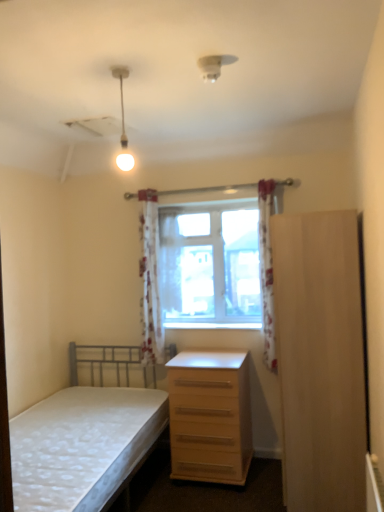
The height and width of the screenshot is (512, 384). Describe the element at coordinates (267, 272) in the screenshot. I see `white floral fabric curtain at right, the 3th curtain from the left` at that location.

Where is `matte white bulb at upper center`? The image size is (384, 512). matte white bulb at upper center is located at coordinates (123, 122).

Locate an element on the screen. The height and width of the screenshot is (512, 384). light wood/file cabinet at right is located at coordinates (320, 360).

From a real-world perspective, is white floral fabric curtain at center, acting as the 3th curtain starting from the right, physically below light wood/file cabinet at right?

No, from a real-world perspective, white floral fabric curtain at center, acting as the 3th curtain starting from the right, is not below light wood/file cabinet at right.

Which object is closer to the camera, white floral fabric curtain at center, which is the first curtain from left to right, or light wood/file cabinet at right?

light wood/file cabinet at right is closer to the camera.

Is white floral fabric curtain at center, which is the first curtain from left to right, taller or shorter than light wood/file cabinet at right?

white floral fabric curtain at center, which is the first curtain from left to right, is shorter than light wood/file cabinet at right.

Can you see white floral fabric curtain at center, which is the first curtain from left to right, touching light wood/file cabinet at right?

There is a gap between white floral fabric curtain at center, which is the first curtain from left to right, and light wood/file cabinet at right.

The image size is (384, 512). I want to click on light fixture located on the left of white floral fabric curtain at right, the first curtain when ordered from right to left, so tap(123, 122).

From a real-world perspective, is white floral fabric curtain at right, the first curtain when ordered from right to left, on top of matte white bulb at upper center?

No, from a real-world perspective, white floral fabric curtain at right, the first curtain when ordered from right to left, is not above matte white bulb at upper center.

In the scene shown: Is white floral fabric curtain at right, which ranks as the 3th curtain in back-to-front order, positioned far away from matte white bulb at upper center?

Yes, white floral fabric curtain at right, which ranks as the 3th curtain in back-to-front order, and matte white bulb at upper center are located far from each other.

Who is smaller, white floral fabric curtain at right, the first curtain when ordered from right to left, or matte white bulb at upper center?

matte white bulb at upper center is smaller.

Which of these two, white floral fabric curtain at right, the first curtain when ordered from right to left, or light wood/wooden chest of drawers at lower right, is thinner?

→ With smaller width is white floral fabric curtain at right, the first curtain when ordered from right to left.

Is white floral fabric curtain at right, the 3th curtain from the left, shorter than light wood/wooden chest of drawers at lower right?

No.

Is white floral fabric curtain at right, the 3th curtain from the left, oriented towards light wood/wooden chest of drawers at lower right?

No, white floral fabric curtain at right, the 3th curtain from the left, is not facing towards light wood/wooden chest of drawers at lower right.

Find the location of a particular element. Image resolution: width=384 pixels, height=512 pixels. curtain that is the 1st one above the light wood/wooden chest of drawers at lower right (from a real-world perspective) is located at coordinates (267, 272).

Is matte white bulb at upper center not close to white floral fabric curtain at center, which is the first curtain from left to right?

matte white bulb at upper center is near white floral fabric curtain at center, which is the first curtain from left to right, not far away.

The height and width of the screenshot is (512, 384). There is a matte white bulb at upper center. Find the location of `the 3rd curtain below it (from the image's perspective)`. the 3rd curtain below it (from the image's perspective) is located at coordinates (150, 281).

Considering the relative sizes of matte white bulb at upper center and white floral fabric curtain at center, acting as the 3th curtain starting from the right, in the image provided, is matte white bulb at upper center thinner than white floral fabric curtain at center, acting as the 3th curtain starting from the right,?

Correct, the width of matte white bulb at upper center is less than that of white floral fabric curtain at center, acting as the 3th curtain starting from the right.

Which is in front, matte white bulb at upper center or white floral fabric curtain at center, which is counted as the second curtain, starting from the front?

matte white bulb at upper center is closer to the camera.

Visually, is light wood/file cabinet at right positioned to the left or to the right of white floral fabric curtain at right, the 3th curtain from the left?

From the image, it's evident that light wood/file cabinet at right is to the right of white floral fabric curtain at right, the 3th curtain from the left.

Is the surface of light wood/file cabinet at right in direct contact with white floral fabric curtain at right, which ranks as the 1th curtain in front-to-back order?

No.

Based on their sizes in the image, would you say light wood/file cabinet at right is bigger or smaller than white floral fabric curtain at right, which ranks as the 1th curtain in front-to-back order?

In the image, light wood/file cabinet at right appears to be larger than white floral fabric curtain at right, which ranks as the 1th curtain in front-to-back order.

Between point (308, 426) and point (265, 218), which one is positioned behind?

Positioned behind is point (265, 218).

Considering the sizes of light wood/wooden chest of drawers at lower right and white floral fabric curtain at center, which ranks as the second curtain in right-to-left order, in the image, is light wood/wooden chest of drawers at lower right wider or thinner than white floral fabric curtain at center, which ranks as the second curtain in right-to-left order,?

light wood/wooden chest of drawers at lower right is wider than white floral fabric curtain at center, which ranks as the second curtain in right-to-left order.

Could you tell me if light wood/wooden chest of drawers at lower right is turned towards white floral fabric curtain at center, which ranks as the second curtain in right-to-left order?

No, light wood/wooden chest of drawers at lower right does not turn towards white floral fabric curtain at center, which ranks as the second curtain in right-to-left order.

Considering the relative sizes of light wood/wooden chest of drawers at lower right and white floral fabric curtain at center, which is the 1th curtain in back-to-front order, in the image provided, is light wood/wooden chest of drawers at lower right shorter than white floral fabric curtain at center, which is the 1th curtain in back-to-front order,?

Indeed, light wood/wooden chest of drawers at lower right has a lesser height compared to white floral fabric curtain at center, which is the 1th curtain in back-to-front order.

Is light wood/wooden chest of drawers at lower right in front of or behind white floral fabric curtain at center, which ranks as the second curtain in right-to-left order, in the image?

In the image, light wood/wooden chest of drawers at lower right appears in front of white floral fabric curtain at center, which ranks as the second curtain in right-to-left order.

Is light wood/wooden chest of drawers at lower right oriented towards clear glass window at center?

No, light wood/wooden chest of drawers at lower right is not oriented towards clear glass window at center.

Can you confirm if light wood/wooden chest of drawers at lower right is smaller than clear glass window at center?

Actually, light wood/wooden chest of drawers at lower right might be larger than clear glass window at center.

Considering the positions of objects light wood/wooden chest of drawers at lower right and clear glass window at center in the image provided, who is more to the right, light wood/wooden chest of drawers at lower right or clear glass window at center?

light wood/wooden chest of drawers at lower right.

Can you tell me how much light wood/wooden chest of drawers at lower right and clear glass window at center differ in facing direction?

0.0895 degrees separate the facing orientations of light wood/wooden chest of drawers at lower right and clear glass window at center.

You are a GUI agent. You are given a task and a screenshot of the screen. Output one action in this format:
    pyautogui.click(x=<x>, y=<y>)
    Task: Click on the file cabinet below the white floral fabric curtain at center, which is the first curtain from left to right (from the image's perspective)
    The image size is (384, 512).
    Given the screenshot: What is the action you would take?
    pyautogui.click(x=320, y=360)

You are a GUI agent. You are given a task and a screenshot of the screen. Output one action in this format:
    pyautogui.click(x=<x>, y=<y>)
    Task: Click on the light fixture on the left of white floral fabric curtain at right, which ranks as the 1th curtain in front-to-back order
    The image size is (384, 512).
    Given the screenshot: What is the action you would take?
    pyautogui.click(x=123, y=122)

From the image, which object appears to be nearer to light wood/wooden chest of drawers at lower right, white floral fabric curtain at right, which ranks as the 3th curtain in back-to-front order, or wooden at center?

The object closer to light wood/wooden chest of drawers at lower right is white floral fabric curtain at right, which ranks as the 3th curtain in back-to-front order.

From the image, which object appears to be farther from wooden at center, white floral fabric curtain at center, which ranks as the second curtain in right-to-left order, or light wood/file cabinet at right?

Based on the image, light wood/file cabinet at right appears to be further to wooden at center.

Looking at the image, which one is located closer to wooden at center, white floral fabric curtain at center, placed as the second curtain when sorted from left to right, or light wood/wooden chest of drawers at lower right?

white floral fabric curtain at center, placed as the second curtain when sorted from left to right, lies closer to wooden at center than the other object.

Considering their positions, is light wood/wooden chest of drawers at lower right positioned further to white fabric bed at lower left than white floral fabric curtain at right, the first curtain when ordered from right to left?

white floral fabric curtain at right, the first curtain when ordered from right to left, lies further to white fabric bed at lower left than the other object.

Considering their positions, is white fabric bed at lower left positioned closer to white floral fabric curtain at center, which is the second curtain from back to front, than light wood/file cabinet at right?

Based on the image, white fabric bed at lower left appears to be nearer to white floral fabric curtain at center, which is the second curtain from back to front.

Which object lies nearer to the anchor point matte white bulb at upper center, white floral fabric curtain at right, the first curtain when ordered from right to left, or wooden at center?

Based on the image, white floral fabric curtain at right, the first curtain when ordered from right to left, appears to be nearer to matte white bulb at upper center.

Which object lies further to the anchor point matte white bulb at upper center, white floral fabric curtain at right, the 3th curtain from the left, or white floral fabric curtain at center, placed as the second curtain when sorted from left to right?

The object further to matte white bulb at upper center is white floral fabric curtain at right, the 3th curtain from the left.

Estimate the real-world distances between objects in this image. Which object is closer to light wood/wooden chest of drawers at lower right, white floral fabric curtain at center, which ranks as the second curtain in right-to-left order, or white floral fabric curtain at right, the 3th curtain from the left?

white floral fabric curtain at right, the 3th curtain from the left, is closer to light wood/wooden chest of drawers at lower right.

This screenshot has height=512, width=384. In order to click on chest of drawers between white fabric bed at lower left and white floral fabric curtain at center, marked as the 3th curtain in a front-to-back arrangement, in the front-back direction in this screenshot , I will do `click(210, 416)`.

Where is `window sill between white floral fabric curtain at center, which is counted as the second curtain, starting from the front, and light wood/wooden chest of drawers at lower right, in the vertical direction`? The image size is (384, 512). window sill between white floral fabric curtain at center, which is counted as the second curtain, starting from the front, and light wood/wooden chest of drawers at lower right, in the vertical direction is located at coordinates (210, 324).

Locate an element on the screen. This screenshot has height=512, width=384. window between white floral fabric curtain at center, acting as the 3th curtain starting from the right, and white floral fabric curtain at right, the 3th curtain from the left, from left to right is located at coordinates (204, 268).

Where is `window sill positioned between matte white bulb at upper center and white floral fabric curtain at center, placed as the second curtain when sorted from left to right, from near to far`? This screenshot has width=384, height=512. window sill positioned between matte white bulb at upper center and white floral fabric curtain at center, placed as the second curtain when sorted from left to right, from near to far is located at coordinates (210, 324).